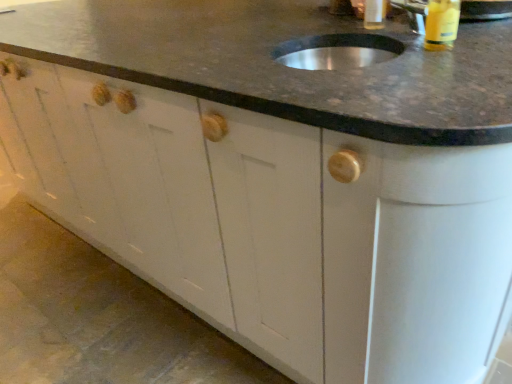
Question: In the image, is yellow plastic bottle at upper right, which is counted as the second beverage, starting from the back, positioned in front of or behind translucent plastic bottle at upper center, which is the first beverage from back to front?

Choices:
 (A) front
 (B) behind

Answer: (A)

Question: Looking at their shapes, would you say yellow plastic bottle at upper right, which is the second beverage in left-to-right order, is wider or thinner than translucent plastic bottle at upper center, which is the first beverage from back to front?

Choices:
 (A) thin
 (B) wide

Answer: (B)

Question: Which of these objects is positioned farthest from the yellow plastic bottle at upper right, which is the second beverage in left-to-right order?

Choices:
 (A) metallic silver sink at upper center
 (B) translucent plastic bottle at upper center, acting as the second beverage starting from the right

Answer: (B)

Question: Considering the real-world distances, which object is closest to the translucent plastic bottle at upper center, acting as the second beverage starting from the right?

Choices:
 (A) yellow plastic bottle at upper right, the 1th beverage in the front-to-back sequence
 (B) metallic silver sink at upper center

Answer: (B)